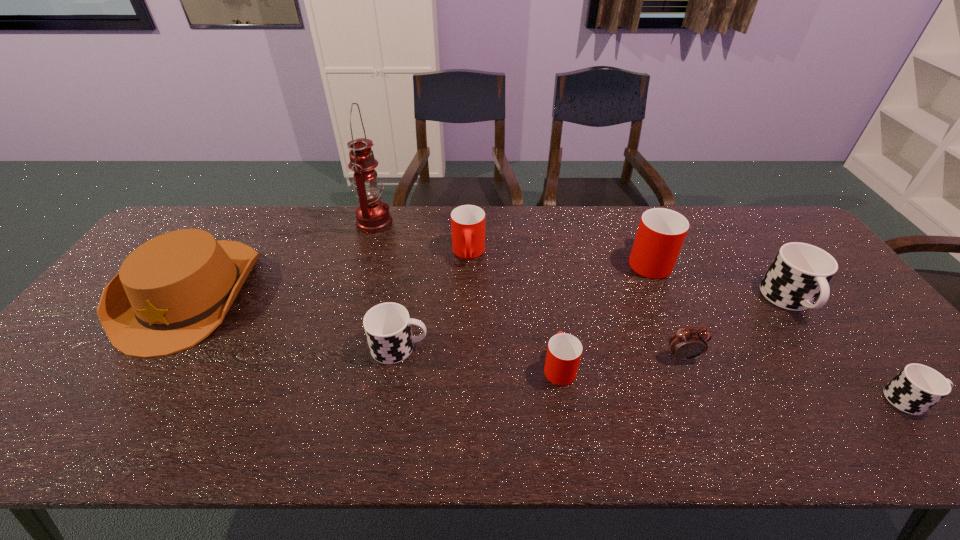
This screenshot has width=960, height=540. I want to click on free spot located on the side of the biggest black cup with the handle, so click(x=822, y=346).

The width and height of the screenshot is (960, 540). I want to click on free space located on the side of the fourth object from left to right with the handle, so click(466, 352).

Identify the location of free point located on the front-facing side of the cowboy hat. (90, 440).

Locate an element on the screen. The height and width of the screenshot is (540, 960). vacant position located 0.050m on the face of the alarm clock is located at coordinates (692, 381).

Identify the location of vacant space located 0.400m on the side of the leftmost black cup with the handle. (588, 347).

Find the location of `free spot located 0.140m on the side of the nearest red cup with the handle`. free spot located 0.140m on the side of the nearest red cup with the handle is located at coordinates (550, 308).

This screenshot has width=960, height=540. In order to click on vacant space located 0.170m on the side of the nearest red cup with the handle in this screenshot , I will do `click(549, 300)`.

Find the location of a particular element. The image size is (960, 540). vacant area located on the side of the nearest red cup with the handle is located at coordinates (548, 295).

This screenshot has width=960, height=540. In order to click on oil lamp present at the far edge in this screenshot , I will do `click(372, 214)`.

Locate an element on the screen. The height and width of the screenshot is (540, 960). cowboy hat located in the far edge section of the desktop is located at coordinates (173, 291).